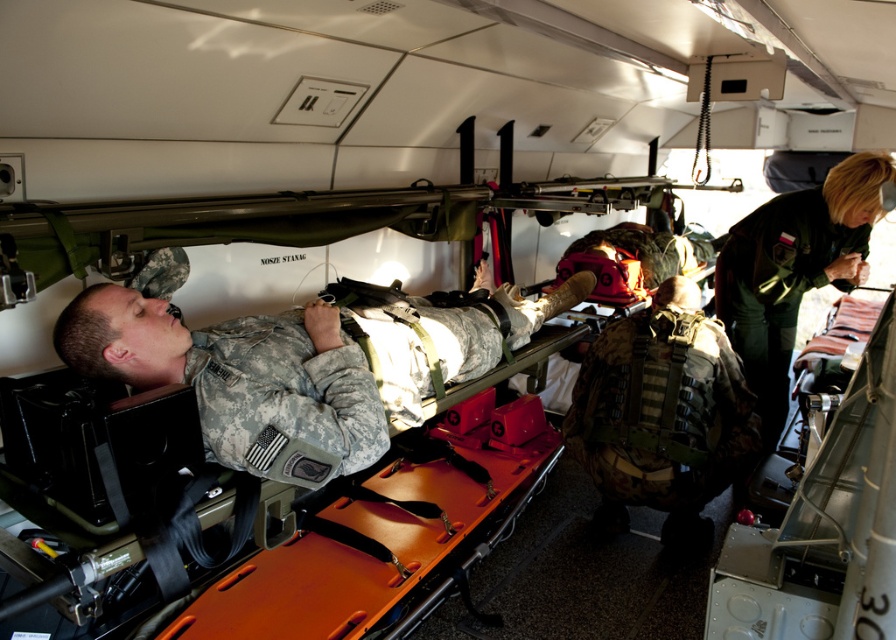
Question: Can you confirm if camouflage fabric soldier at center is positioned below camo fabric vest at center?

Choices:
 (A) no
 (B) yes

Answer: (A)

Question: Can you confirm if camouflage fabric soldier at center is smaller than camo fabric vest at center?

Choices:
 (A) no
 (B) yes

Answer: (A)

Question: Is camouflage fabric soldier at center to the right of green uniform at center from the viewer's perspective?

Choices:
 (A) yes
 (B) no

Answer: (B)

Question: Considering the real-world distances, which object is closest to the camo fabric vest at center?

Choices:
 (A) green uniform at center
 (B) camouflage fabric soldier at center

Answer: (A)

Question: Which object is closer to the camera taking this photo?

Choices:
 (A) green uniform at center
 (B) camo fabric vest at center

Answer: (B)

Question: Which object is positioned closest to the green uniform at center?

Choices:
 (A) camouflage fabric soldier at center
 (B) camo fabric vest at center

Answer: (B)